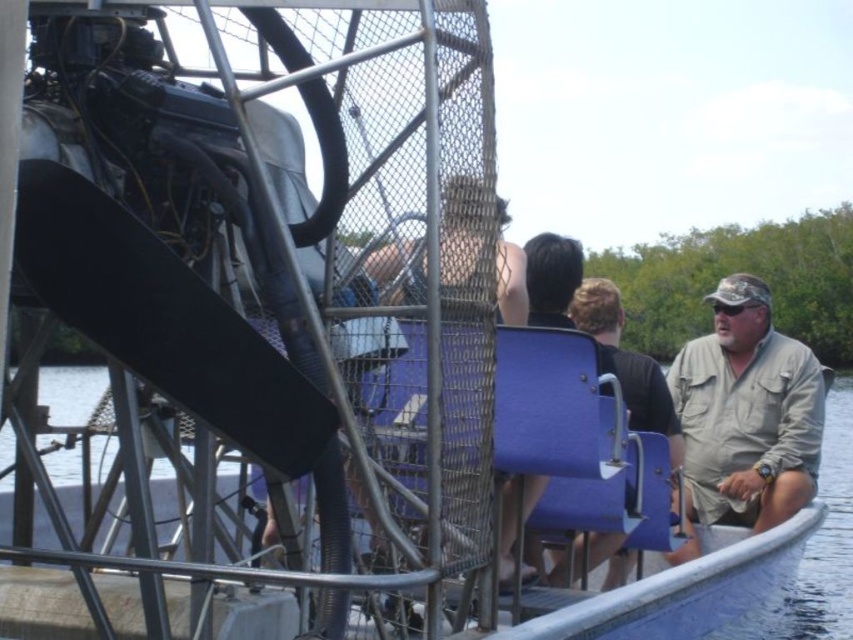
You are a photographer standing on the dock preparing to take a photo of the khaki fabric shirt at right and the blue plastic seat at center on the airboat. Which object should you focus on first to ensure it appears sharp in the photo?

The khaki fabric shirt at right is closer to you than the blue plastic seat at center, so you should focus on the khaki fabric shirt at right first to ensure it appears sharp in the photo.